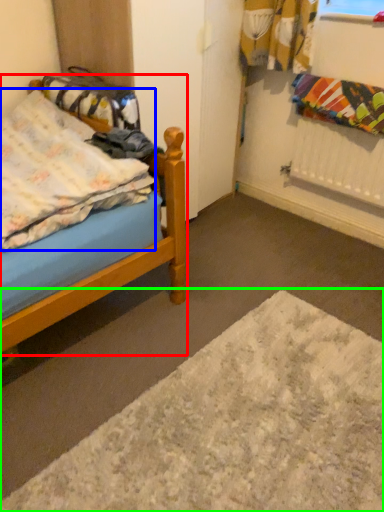
Question: Based on their relative distances, which object is nearer to bed (highlighted by a red box)? Choose from blanket (highlighted by a blue box) and plain (highlighted by a green box).

Choices:
 (A) blanket
 (B) plain

Answer: (A)